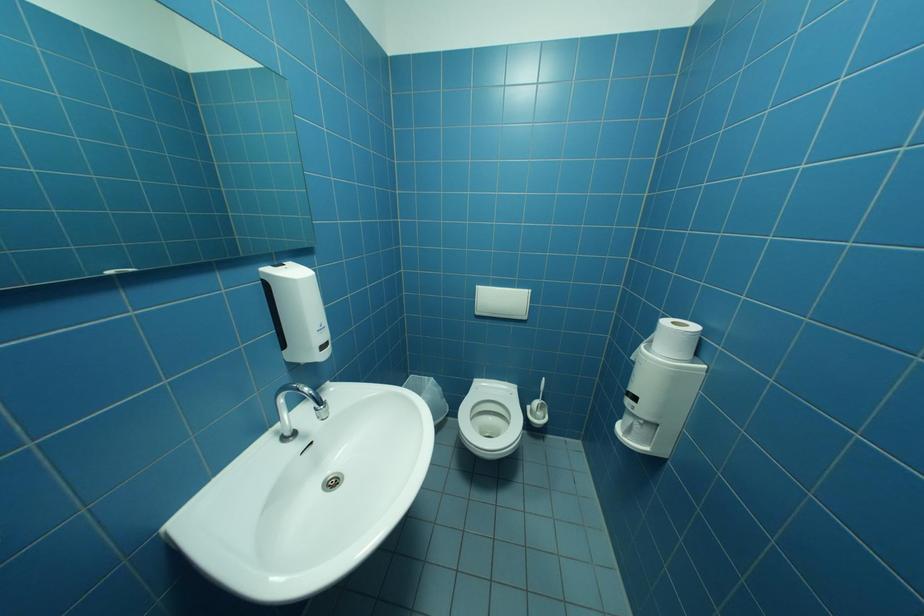
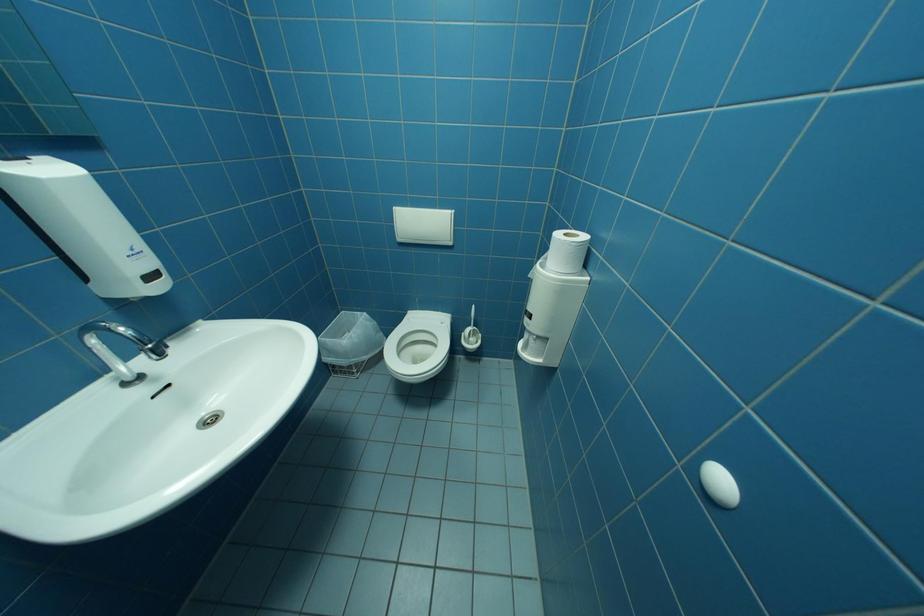
Question: Which direction would the cameraman need to move to produce the second image? Reply with the corresponding letter.

Choices:
 (A) Left
 (B) Right
 (C) Forward
 (D) Backward

Answer: (B)